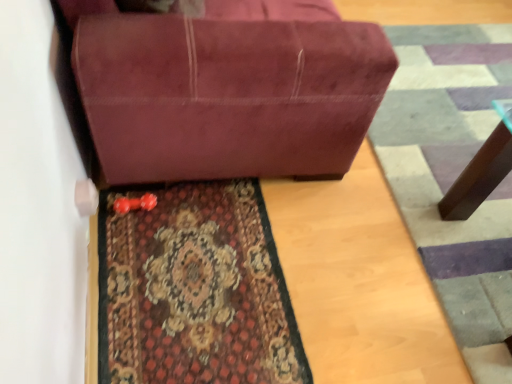
Image resolution: width=512 pixels, height=384 pixels. In order to click on unoccupied area in front of suede-like maroon couch at center in this screenshot , I will do `click(234, 280)`.